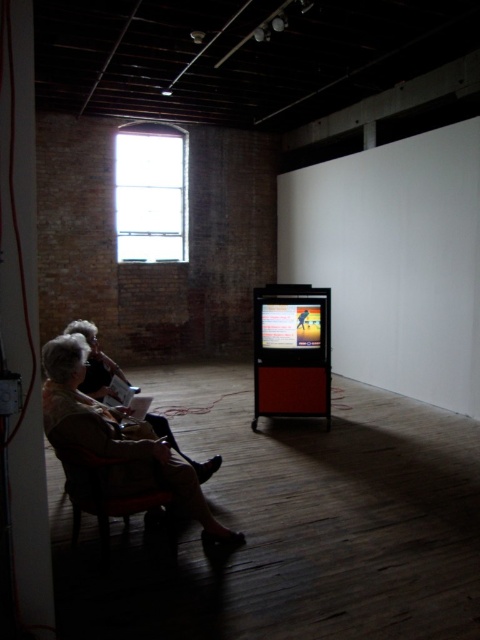
You are an interior designer planning to place a tall plant in the room. You see the matte beige sweater at left and the dark brown leather armchair at lower left. Which object should you place the plant next to if you want it to be taller than both?

The matte beige sweater at left is much taller than the dark brown leather armchair at lower left. Therefore, placing the plant next to the matte beige sweater at left would ensure it is taller than both objects.

Consider the image. You are a person who is 5 feet tall standing in the room. You want to pick up the matte beige sweater at left from the dark brown leather armchair at lower left. Can you reach it without moving the chair?

The distance between the matte beige sweater at left and the dark brown leather armchair at lower left is 7.28 inches. Since you are 5 feet tall, you can easily reach the sweater from the chair without needing to move it.

Consider the image. You are an interior designer assessing the seating arrangement in the gallery. You need to determine if the matte beige sweater at left can be placed on the dark brown leather armchair at lower left without any issues. Based on their sizes, what would you advise?

The matte beige sweater at left is wider than the dark brown leather armchair at lower left, so placing it might cause the sweater to hang over the edges or not fit properly. Consider choosing a larger chair or a smaller sweater for better fit.